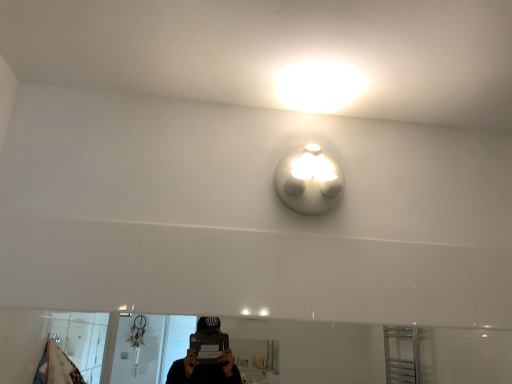
What do you see at coordinates (319, 349) in the screenshot? This screenshot has width=512, height=384. I see `white glossy mirror at lower center` at bounding box center [319, 349].

At what (x,y) coordinates should I click in order to perform the action: click on white glossy mirror at lower center. Please return your answer as a coordinate pair (x, y). The height and width of the screenshot is (384, 512). Looking at the image, I should click on (319, 349).

The width and height of the screenshot is (512, 384). Find the location of `white matte light fixture at upper center`. white matte light fixture at upper center is located at coordinates (309, 181).

What do you see at coordinates (309, 181) in the screenshot? The image size is (512, 384). I see `white matte light fixture at upper center` at bounding box center [309, 181].

The width and height of the screenshot is (512, 384). Identify the location of white glossy mirror at lower center. (319, 349).

Which is more to the right, white glossy mirror at lower center or white matte light fixture at upper center?

white matte light fixture at upper center is more to the right.

Is white glossy mirror at lower center in front of white matte light fixture at upper center?

Yes.

Which is further, [23,377] or [311,160]?

Point [23,377]

From the image's perspective, who appears lower, white glossy mirror at lower center or white matte light fixture at upper center?

→ white glossy mirror at lower center.

From a real-world perspective, is white glossy mirror at lower center located higher than white matte light fixture at upper center?

Incorrect, from a real-world perspective, white glossy mirror at lower center is lower than white matte light fixture at upper center.

Considering the sizes of white glossy mirror at lower center and white matte light fixture at upper center in the image, is white glossy mirror at lower center wider or thinner than white matte light fixture at upper center?

Considering their sizes, white glossy mirror at lower center looks slimmer than white matte light fixture at upper center.

Does white glossy mirror at lower center have a greater height compared to white matte light fixture at upper center?

In fact, white glossy mirror at lower center may be shorter than white matte light fixture at upper center.

Considering the relative sizes of white glossy mirror at lower center and white matte light fixture at upper center in the image provided, is white glossy mirror at lower center smaller than white matte light fixture at upper center?

Actually, white glossy mirror at lower center might be larger than white matte light fixture at upper center.

Consider the image. Which is correct: white glossy mirror at lower center is inside white matte light fixture at upper center, or outside of it?

white glossy mirror at lower center is not enclosed by white matte light fixture at upper center.

Is white glossy mirror at lower center beside white matte light fixture at upper center?

white glossy mirror at lower center and white matte light fixture at upper center are not in contact.

Is white glossy mirror at lower center aimed at white matte light fixture at upper center?

No, white glossy mirror at lower center does not turn towards white matte light fixture at upper center.

Measure the distance from white glossy mirror at lower center to white matte light fixture at upper center.

white glossy mirror at lower center is 2.34 meters from white matte light fixture at upper center.

The height and width of the screenshot is (384, 512). Find the location of `light above the white glossy mirror at lower center (from the image's perspective)`. light above the white glossy mirror at lower center (from the image's perspective) is located at coordinates (309, 181).

Which is more to the right, white matte light fixture at upper center or white glossy mirror at lower center?

From the viewer's perspective, white matte light fixture at upper center appears more on the right side.

Does white matte light fixture at upper center lie behind white glossy mirror at lower center?

Yes.

Which point is more forward, (280, 191) or (367, 341)?

Point (280, 191)

From the image's perspective, is white matte light fixture at upper center on top of white glossy mirror at lower center?

Correct, white matte light fixture at upper center appears higher than white glossy mirror at lower center in the image.

From a real-world perspective, which object stands above the other?

white matte light fixture at upper center is physically above.

Is white matte light fixture at upper center wider or thinner than white glossy mirror at lower center?

white matte light fixture at upper center is wider than white glossy mirror at lower center.

Which of these two, white matte light fixture at upper center or white glossy mirror at lower center, stands taller?

white matte light fixture at upper center.

Does white matte light fixture at upper center have a smaller size compared to white glossy mirror at lower center?

Yes, white matte light fixture at upper center is smaller than white glossy mirror at lower center.

Does white matte light fixture at upper center contain white glossy mirror at lower center?

Actually, white glossy mirror at lower center is outside white matte light fixture at upper center.

In the scene shown: Are white matte light fixture at upper center and white glossy mirror at lower center located far from each other?

Yes, white matte light fixture at upper center and white glossy mirror at lower center are located far from each other.

Is white glossy mirror at lower center at the back of white matte light fixture at upper center?

No, white matte light fixture at upper center is not facing the opposite direction of white glossy mirror at lower center.

What's the angular difference between white matte light fixture at upper center and white glossy mirror at lower center's facing directions?

The angular difference between white matte light fixture at upper center and white glossy mirror at lower center is 0.00307 degrees.

Measure the distance from white matte light fixture at upper center to white glossy mirror at lower center.

The distance of white matte light fixture at upper center from white glossy mirror at lower center is 2.34 meters.

Identify the location of light that is behind the white glossy mirror at lower center. Image resolution: width=512 pixels, height=384 pixels. (309, 181).

In the image, there is a white matte light fixture at upper center. Where is `mirror below it (from the image's perspective)`? This screenshot has height=384, width=512. mirror below it (from the image's perspective) is located at coordinates (319, 349).

Find the location of a particular element. light that is above the white glossy mirror at lower center (from the image's perspective) is located at coordinates (309, 181).